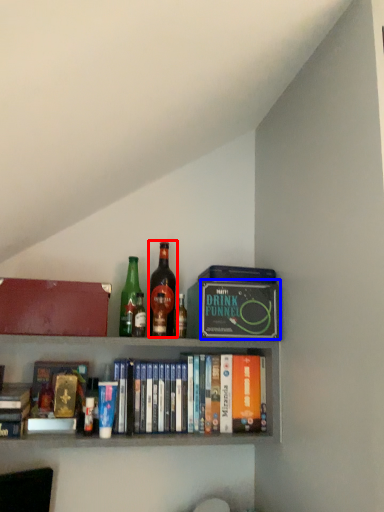
Question: Which object is further to the camera taking this photo, bottle (highlighted by a red box) or paperback book (highlighted by a blue box)?

Choices:
 (A) bottle
 (B) paperback book

Answer: (A)